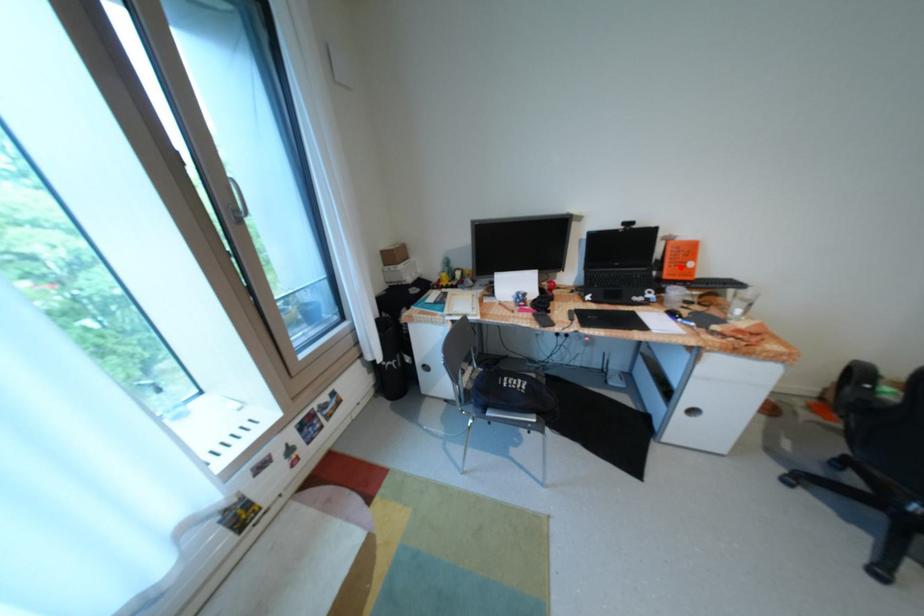
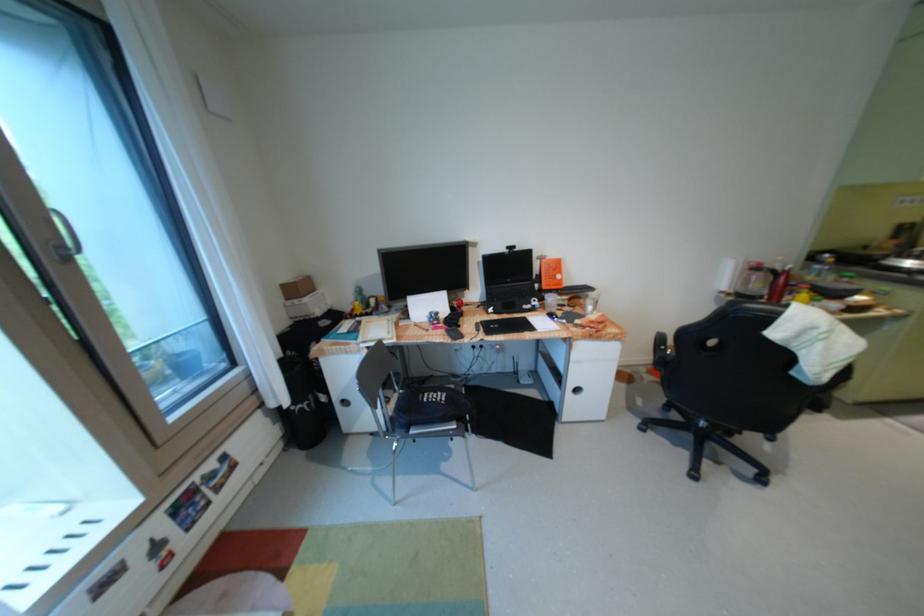
Question: I am providing you with two images of the same scene from different viewpoints. A red point is marked on the first image. At the location where the point appears in image 1, is it still visible in image 2?

Choices:
 (A) Yes
 (B) No

Answer: (A)